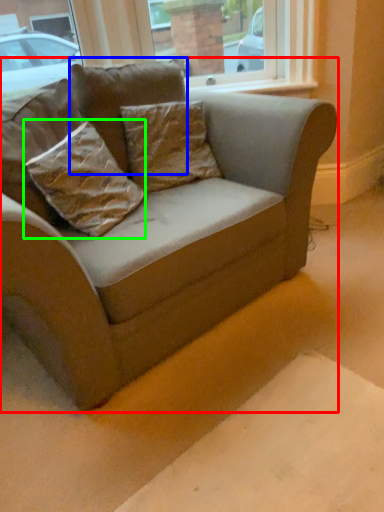
Question: Which object is positioned farthest from studio couch (highlighted by a red box)? Select from pillow (highlighted by a blue box) and pillow (highlighted by a green box).

Choices:
 (A) pillow
 (B) pillow

Answer: (A)